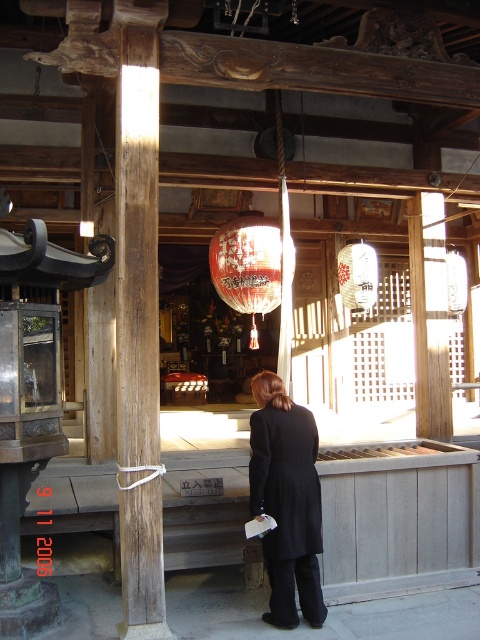
You are standing in the temple and want to place a small offering on the nearest object. Which object should you choose between the weathered wood pole at left and the white paper lantern at center?

The weathered wood pole at left is closer to the viewer than the white paper lantern at center, so you should place the offering on the weathered wood pole at left.

You are a visitor at the temple and notice the weathered wood pole at left and the black wool coat at center. Which object is narrower in width?

The weathered wood pole at left is narrower in width compared to the black wool coat at center.

You are a visitor at the temple and want to place a small offering between the weathered wood pole at left and the white paper lantern at center. The offering requires a space of 7 feet. Can you fit it there?

The weathered wood pole at left and white paper lantern at center are 8.08 feet apart from each other, so yes, the offering can be placed between them as there is sufficient space.